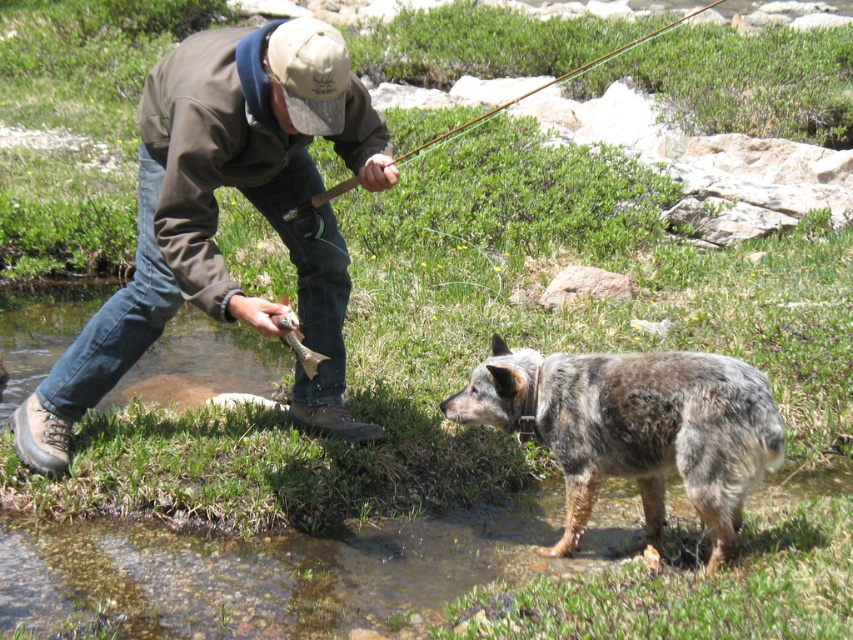
Between brown fleece jacket at center and speckled fur dog at lower right, which one is positioned lower?

speckled fur dog at lower right is below.

Does point (248, 140) come closer to viewer compared to point (712, 420)?

No.

This screenshot has width=853, height=640. Identify the location of brown fleece jacket at center. (218, 216).

The width and height of the screenshot is (853, 640). I want to click on brown fleece jacket at center, so click(218, 216).

Is brown fleece jacket at center to the left of wooden fishing rod at upper center from the viewer's perspective?

Yes, brown fleece jacket at center is to the left of wooden fishing rod at upper center.

Find the location of a particular element. The width and height of the screenshot is (853, 640). brown fleece jacket at center is located at coordinates (218, 216).

Find the location of a particular element. Image resolution: width=853 pixels, height=640 pixels. brown fleece jacket at center is located at coordinates (218, 216).

Which of these two, wooden fishing rod at upper center or shiny silver fish at center, stands shorter?

shiny silver fish at center

Is point (662, 26) less distant than point (303, 336)?

No, (662, 26) is behind (303, 336).

Where is `wooden fishing rod at upper center`? The width and height of the screenshot is (853, 640). wooden fishing rod at upper center is located at coordinates (544, 86).